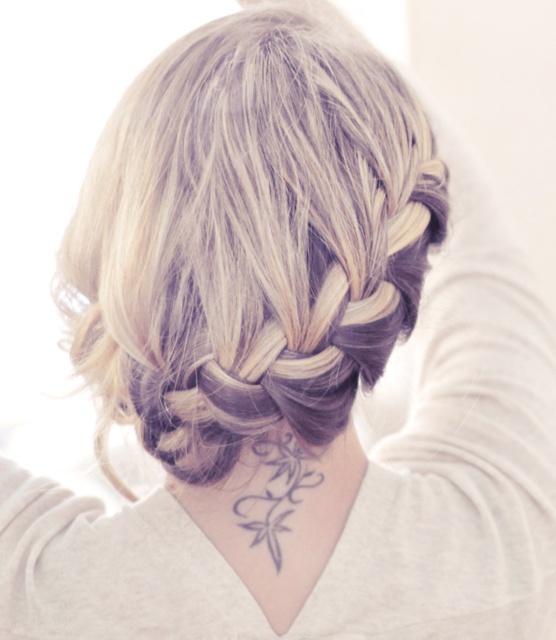
Which of these two, black tattoo at center or gray ink floral design at center back, stands shorter?

With less height is gray ink floral design at center back.

Can you confirm if black tattoo at center is smaller than gray ink floral design at center back?

No.

Image resolution: width=556 pixels, height=640 pixels. Identify the location of black tattoo at center. (279, 506).

Find the location of a particular element. The height and width of the screenshot is (640, 556). black tattoo at center is located at coordinates (279, 506).